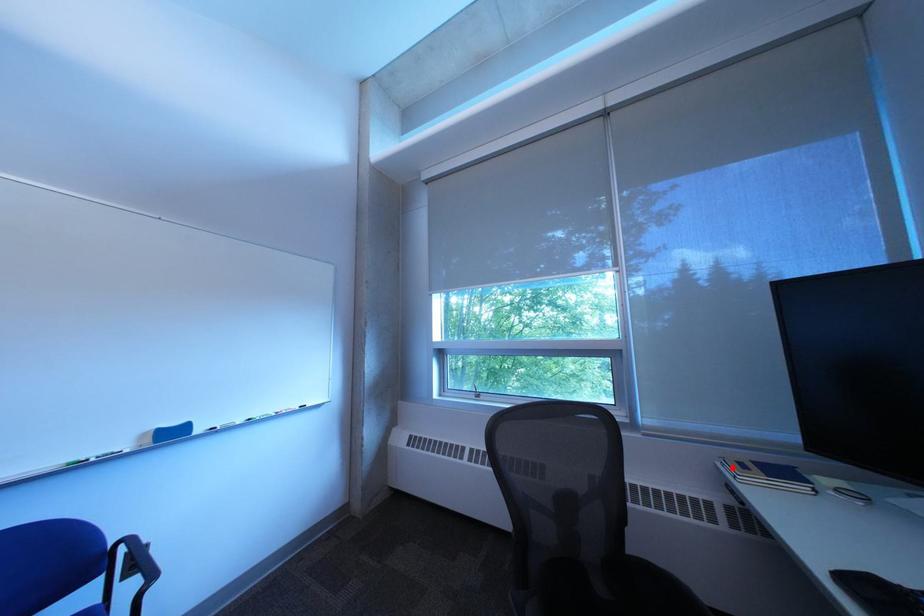
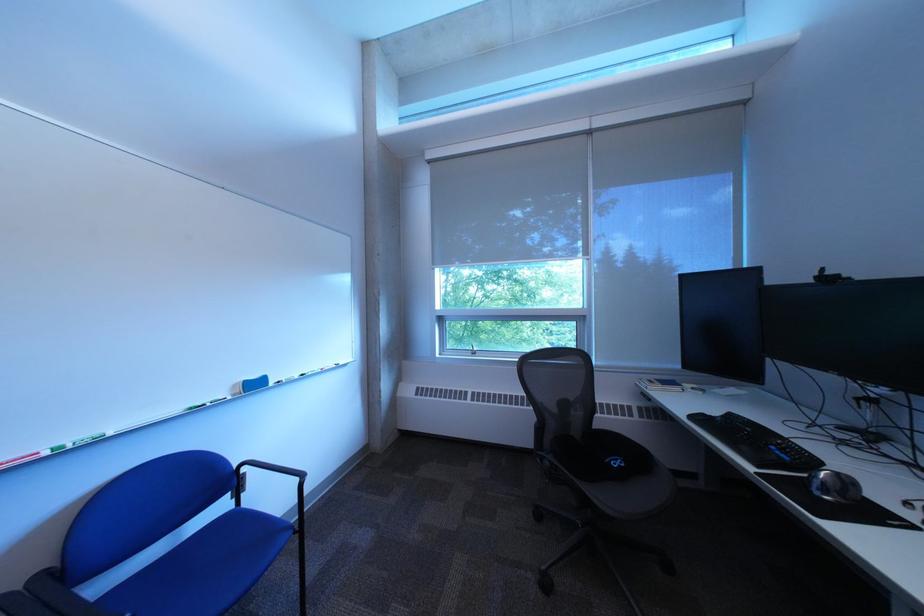
Question: I am providing you with two images of the same scene from different viewpoints. A red point is shown in image1. For the corresponding object point in image2, is it positioned nearer or farther from the camera?

Choices:
 (A) Nearer
 (B) Farther

Answer: (B)